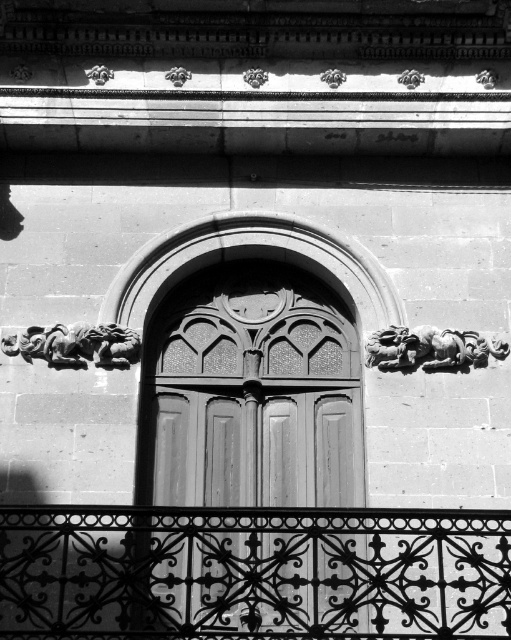
Question: Can you confirm if matte wood door at center is positioned to the left of carved stone dragon at left?

Choices:
 (A) yes
 (B) no

Answer: (B)

Question: Estimate the real-world distances between objects in this image. Which object is closer to the polished stone sculpture at upper right?

Choices:
 (A) matte wood door at center
 (B) black wrought iron at lower center
 (C) carved stone dragon at left

Answer: (A)

Question: Among these objects, which one is farthest from the camera?

Choices:
 (A) matte wood door at center
 (B) polished stone sculpture at upper right
 (C) carved stone dragon at left
 (D) black wrought iron at lower center

Answer: (B)

Question: Is matte wood door at center to the right of carved stone dragon at left from the viewer's perspective?

Choices:
 (A) yes
 (B) no

Answer: (A)

Question: Which object appears closest to the camera in this image?

Choices:
 (A) polished stone sculpture at upper right
 (B) black wrought iron at lower center
 (C) carved stone dragon at left

Answer: (B)

Question: Is the position of black wrought iron at lower center more distant than that of carved stone dragon at left?

Choices:
 (A) yes
 (B) no

Answer: (B)